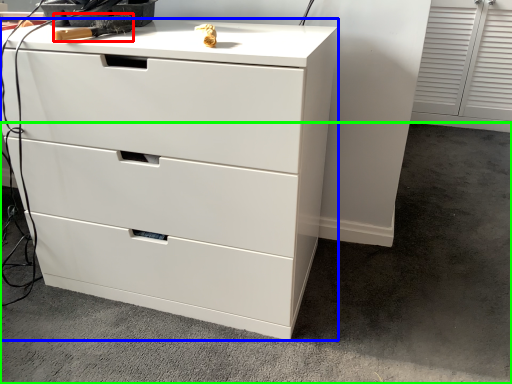
Question: Which is farther away from tool (highlighted by a red box)? chest of drawers (highlighted by a blue box) or concrete (highlighted by a green box)?

Choices:
 (A) chest of drawers
 (B) concrete

Answer: (B)